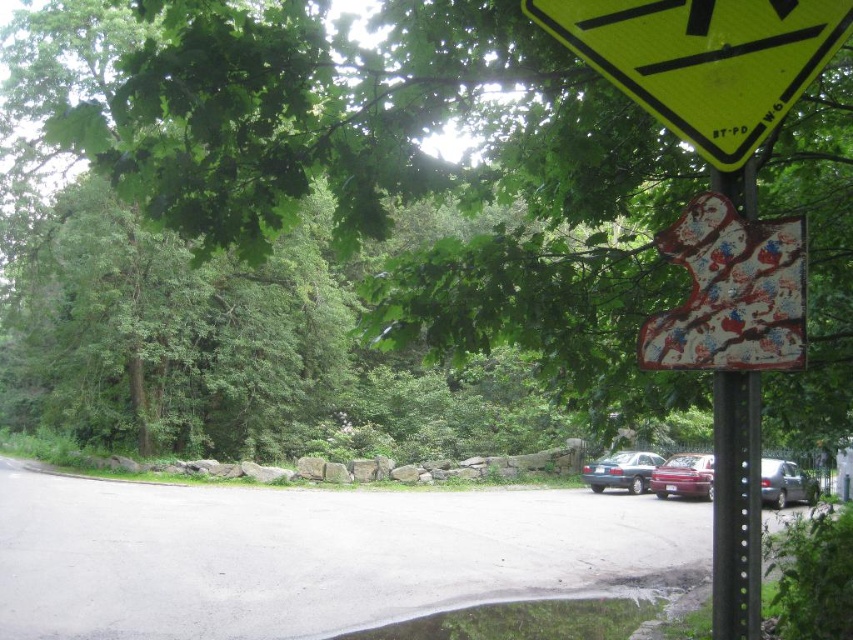
Which is above, matte blue sedan at center or shiny maroon sedan at lower right?

shiny maroon sedan at lower right

Is point (634, 454) less distant than point (709, 470)?

No, (634, 454) is further to viewer.

Locate an element on the screen. The height and width of the screenshot is (640, 853). matte blue sedan at center is located at coordinates (621, 470).

Where is `matte blue sedan at center`? The width and height of the screenshot is (853, 640). matte blue sedan at center is located at coordinates (621, 470).

Between green leafy tree at upper center and yellow reflective plastic triangle at upper right, which one appears on the right side from the viewer's perspective?

From the viewer's perspective, yellow reflective plastic triangle at upper right appears more on the right side.

Who is more forward, (138,284) or (587,40)?

Point (587,40) is more forward.

Between point (566, 342) and point (827, 8), which one is positioned in front?

Point (827, 8) is in front.

Image resolution: width=853 pixels, height=640 pixels. I want to click on green leafy tree at upper center, so click(323, 227).

Is black metal signpost at right bigger than shiny maroon sedan at lower right?

Incorrect, black metal signpost at right is not larger than shiny maroon sedan at lower right.

Can you confirm if black metal signpost at right is positioned to the right of shiny maroon sedan at lower right?

In fact, black metal signpost at right is to the left of shiny maroon sedan at lower right.

At what (x,y) coordinates should I click in order to perform the action: click on black metal signpost at right. Please return your answer as a coordinate pair (x, y). The height and width of the screenshot is (640, 853). Looking at the image, I should click on (x=735, y=506).